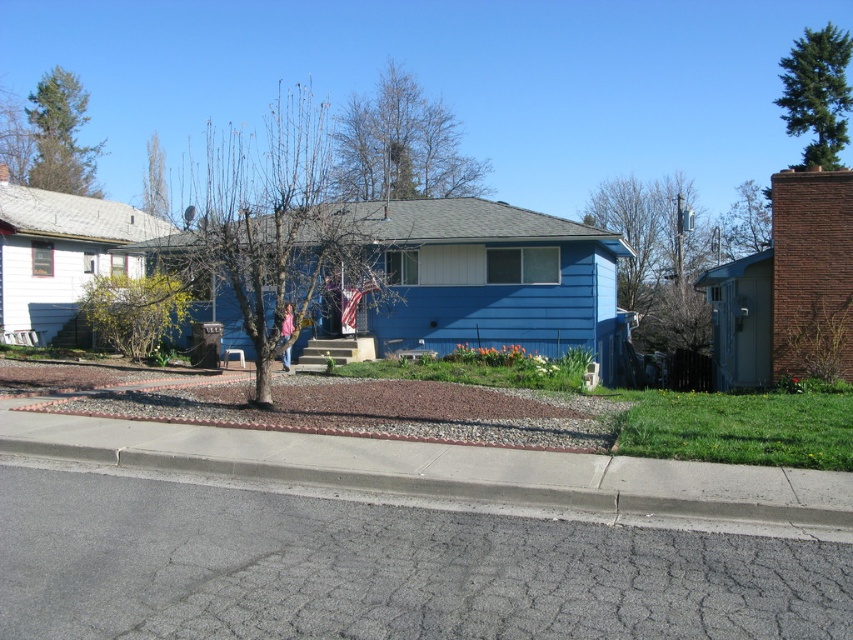
Which is below, bare branches at center or yellow-green foliage at center-left?

yellow-green foliage at center-left is below.

The width and height of the screenshot is (853, 640). What are the coordinates of `bare branches at center` in the screenshot? It's located at (279, 230).

What do you see at coordinates (134, 310) in the screenshot?
I see `yellow-green foliage at center-left` at bounding box center [134, 310].

Between yellow-green foliage at center-left and green textured tree at upper left, which one is positioned higher?

green textured tree at upper left

Image resolution: width=853 pixels, height=640 pixels. What do you see at coordinates (134, 310) in the screenshot? I see `yellow-green foliage at center-left` at bounding box center [134, 310].

Find the location of a particular element. The width and height of the screenshot is (853, 640). yellow-green foliage at center-left is located at coordinates (134, 310).

Can you confirm if bare branches at upper center is positioned to the right of yellow-green foliage at center-left?

Correct, you'll find bare branches at upper center to the right of yellow-green foliage at center-left.

The width and height of the screenshot is (853, 640). What do you see at coordinates (401, 145) in the screenshot?
I see `bare branches at upper center` at bounding box center [401, 145].

Find the location of a particular element. The height and width of the screenshot is (640, 853). bare branches at upper center is located at coordinates (401, 145).